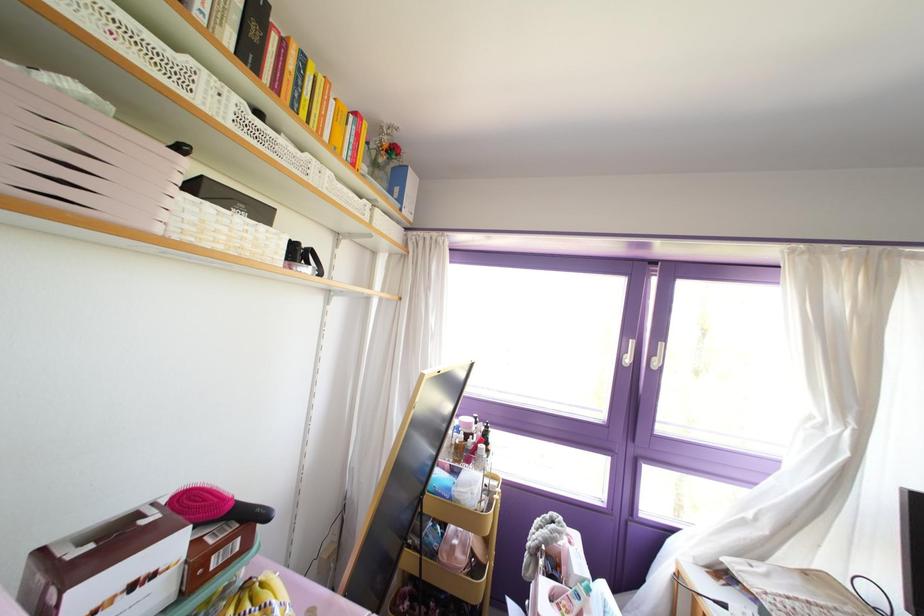
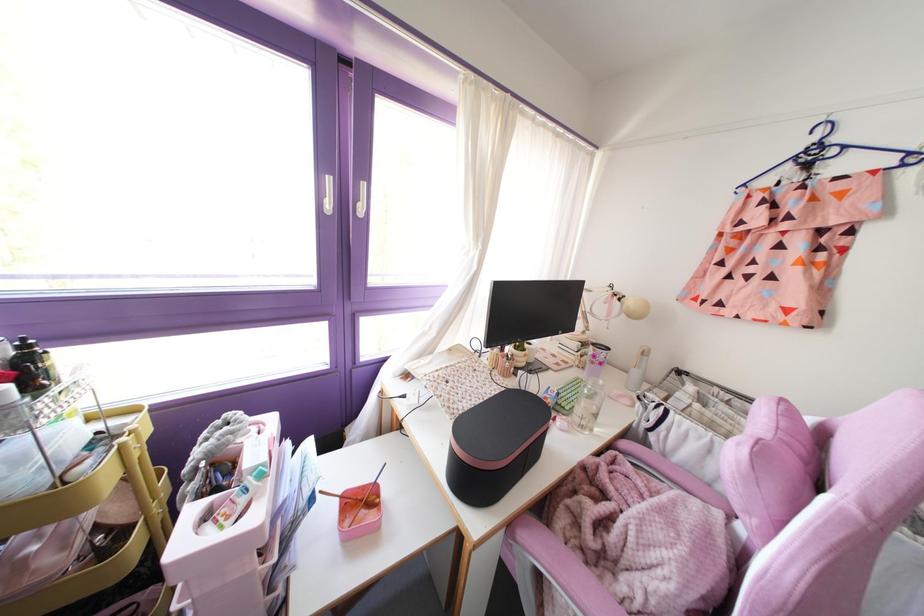
In the second image, find the point that corresponds to point (626, 360) in the first image.

(329, 205)